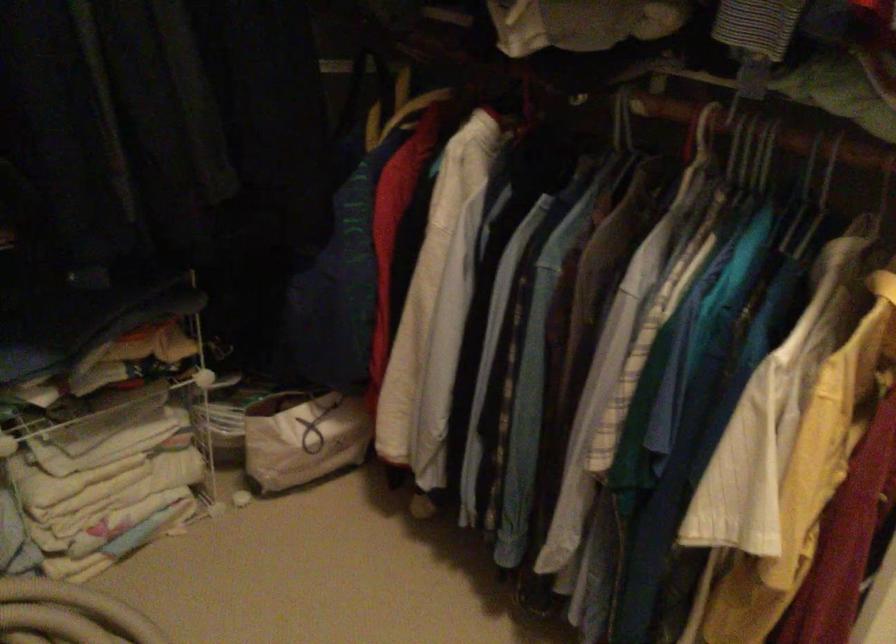
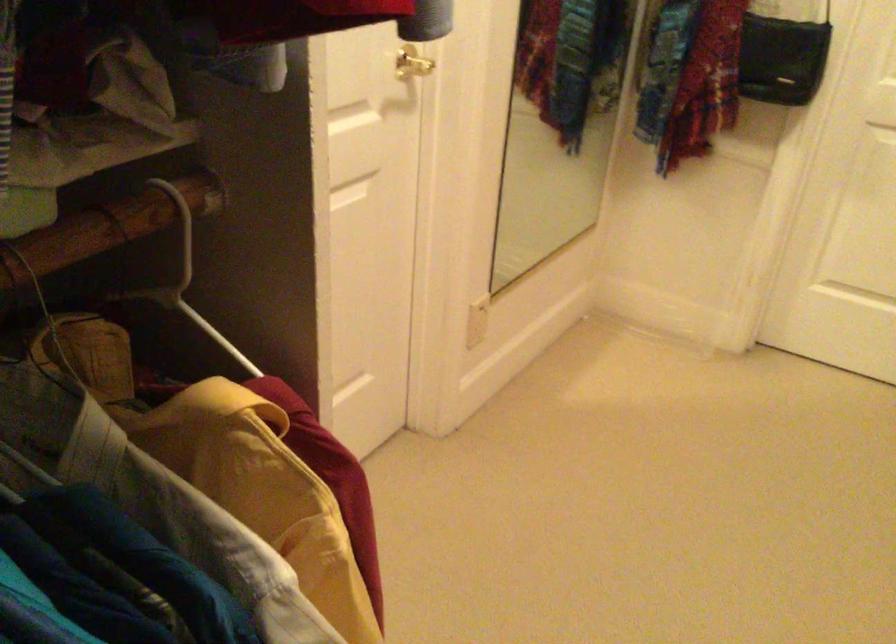
First-person continuous shooting, in which direction is the camera rotating?

The camera's rotation is toward right-down.